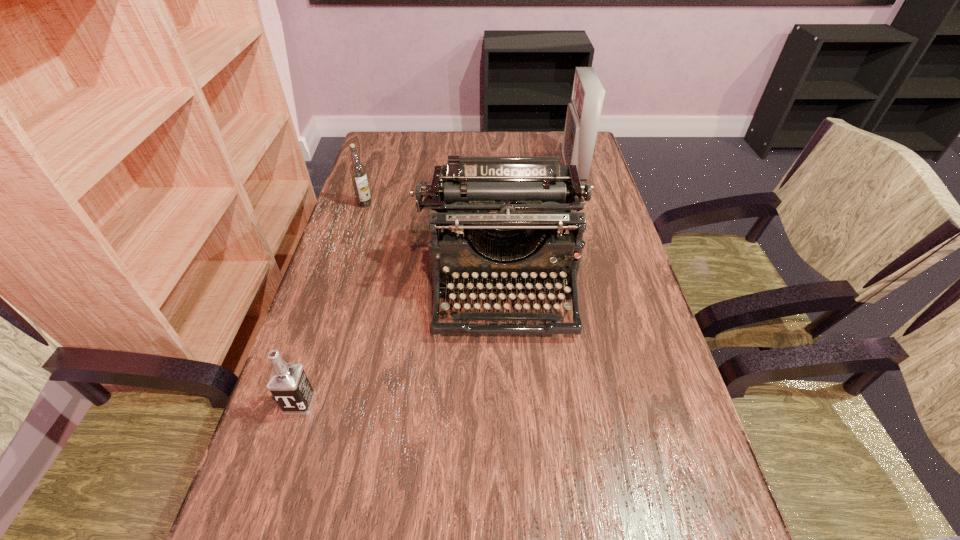
Find the location of a particular element. vacant area at the right edge of the desktop is located at coordinates (591, 204).

Locate an element on the screen. free space at the far left corner of the desktop is located at coordinates (392, 166).

At what (x,y) coordinates should I click in order to perform the action: click on unoccupied position between the nearer vodka and the third farthest object. Please return your answer as a coordinate pair (x, y). The image size is (960, 540). Looking at the image, I should click on (401, 345).

The width and height of the screenshot is (960, 540). I want to click on free space that is in between the taller vodka and the shortest object, so click(x=332, y=303).

Where is `unoccupied position between the shorter vodka and the second farthest object`? Image resolution: width=960 pixels, height=540 pixels. unoccupied position between the shorter vodka and the second farthest object is located at coordinates (332, 303).

Locate an element on the screen. This screenshot has width=960, height=540. vacant area that lies between the shorter vodka and the farther vodka is located at coordinates (332, 303).

Where is `vacant area that lies between the third object from left to right and the shorter vodka`? Image resolution: width=960 pixels, height=540 pixels. vacant area that lies between the third object from left to right and the shorter vodka is located at coordinates (401, 345).

Image resolution: width=960 pixels, height=540 pixels. I want to click on free area in between the third object from left to right and the nearer vodka, so click(401, 345).

The image size is (960, 540). What are the coordinates of `the third closest object to the second nearest object` in the screenshot? It's located at coord(583,113).

Identify which object is located as the nearest to the farthest object. Please provide its 2D coordinates. Your answer should be formatted as a tuple, i.e. [(x, y)], where the tuple contains the x and y coordinates of a point satisfying the conditions above.

[(513, 208)]